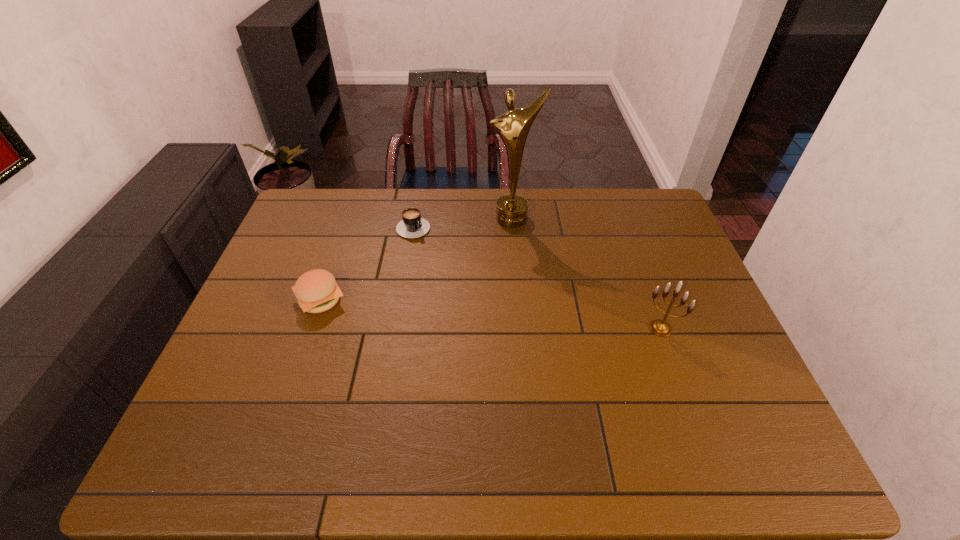
In the image, there is a desktop. Where is `vacant space at the far edge`? The image size is (960, 540). vacant space at the far edge is located at coordinates (373, 191).

This screenshot has height=540, width=960. Identify the location of blank space at the near edge. (664, 388).

Where is `free space at the left edge`? free space at the left edge is located at coordinates (241, 347).

Identify the location of vacant space at the right edge of the desktop. The height and width of the screenshot is (540, 960). (727, 336).

In the image, there is a desktop. Where is `vacant space at the far left corner`? vacant space at the far left corner is located at coordinates (311, 210).

At what (x,y) coordinates should I click in order to perform the action: click on vacant space that is in between the shortest object and the leftmost object. Please return your answer as a coordinate pair (x, y). Looking at the image, I should click on (368, 262).

Find the location of a particular element. vacant region between the second object from left to right and the rightmost object is located at coordinates (538, 276).

This screenshot has height=540, width=960. In order to click on unoccupied position between the tallest object and the rightmost object in this screenshot , I will do `click(587, 273)`.

Where is `empty space between the leftmost object and the second object from right to left`? The width and height of the screenshot is (960, 540). empty space between the leftmost object and the second object from right to left is located at coordinates (417, 259).

I want to click on free point between the second shortest object and the third object from right to left, so click(368, 262).